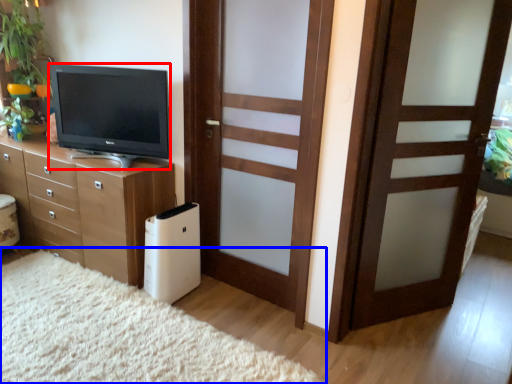
Question: Which object is further to the camera taking this photo, television (highlighted by a red box) or plain (highlighted by a blue box)?

Choices:
 (A) television
 (B) plain

Answer: (A)